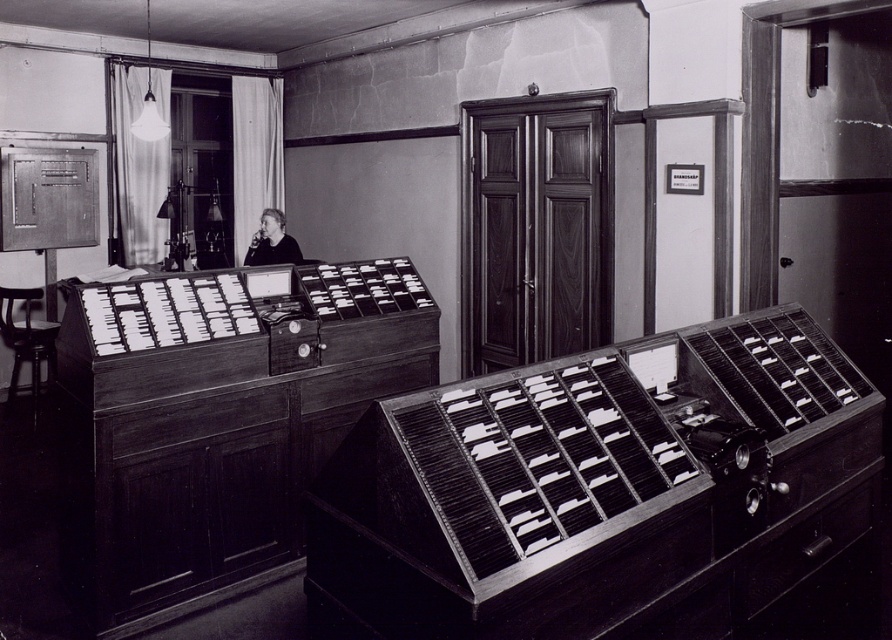
Is point (772, 556) closer to camera compared to point (15, 323)?

Yes, it is.

Does metallic drawer at lower right appear on the left side of dark wood stool at left?

Incorrect, metallic drawer at lower right is not on the left side of dark wood stool at left.

Which is in front, point (838, 538) or point (34, 378)?

Point (838, 538) is more forward.

Find the location of a particular element. Image resolution: width=892 pixels, height=640 pixels. metallic drawer at lower right is located at coordinates (802, 548).

Can you confirm if metallic drawer at lower right is taller than dark gray fabric jacket at center?

No.

Which is in front, point (774, 566) or point (279, 218)?

Point (774, 566) is in front.

You are a GUI agent. You are given a task and a screenshot of the screen. Output one action in this format:
    pyautogui.click(x=<x>, y=<y>)
    Task: Click on the metallic drawer at lower right
    The height and width of the screenshot is (640, 892).
    Given the screenshot: What is the action you would take?
    pyautogui.click(x=802, y=548)

Is point (48, 365) positioned after point (275, 248)?

Yes, it is behind point (275, 248).

Does dark wood stool at left have a smaller size compared to dark gray fabric jacket at center?

Correct, dark wood stool at left occupies less space than dark gray fabric jacket at center.

Where is `dark wood stool at left`? Image resolution: width=892 pixels, height=640 pixels. dark wood stool at left is located at coordinates (27, 339).